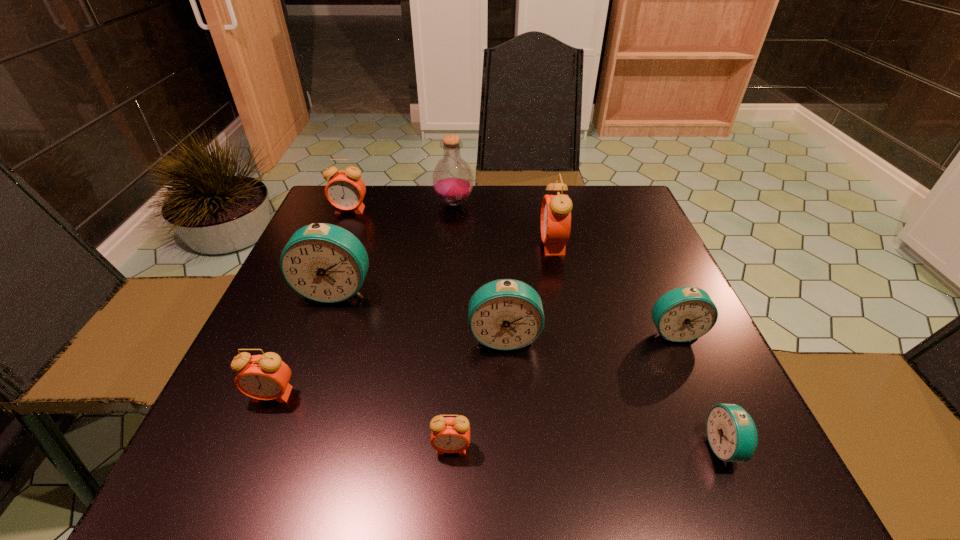
Image resolution: width=960 pixels, height=540 pixels. Identify the location of purple bottle. (452, 179).

Locate an element on the screen. This screenshot has height=540, width=960. the rightmost pink alarm clock is located at coordinates (556, 208).

In order to click on the seventh nearest object in this screenshot , I will do tap(556, 208).

What are the coordinates of `the sixth nearest alarm clock` in the screenshot? It's located at (325, 263).

Identify the location of the fourth farthest object. The width and height of the screenshot is (960, 540). (325, 263).

The image size is (960, 540). Identify the location of the second biggest pink alarm clock. (345, 190).

I want to click on the farthest alarm clock, so click(345, 190).

Identify the location of the third blue alarm clock from right to left. The width and height of the screenshot is (960, 540). (506, 314).

I want to click on the sixth farthest alarm clock, so click(x=265, y=377).

You are a GUI agent. You are given a task and a screenshot of the screen. Output one action in this format:
    pyautogui.click(x=<x>, y=<y>)
    Task: Click on the seventh farthest object
    This screenshot has width=960, height=540.
    Given the screenshot: What is the action you would take?
    pyautogui.click(x=265, y=377)